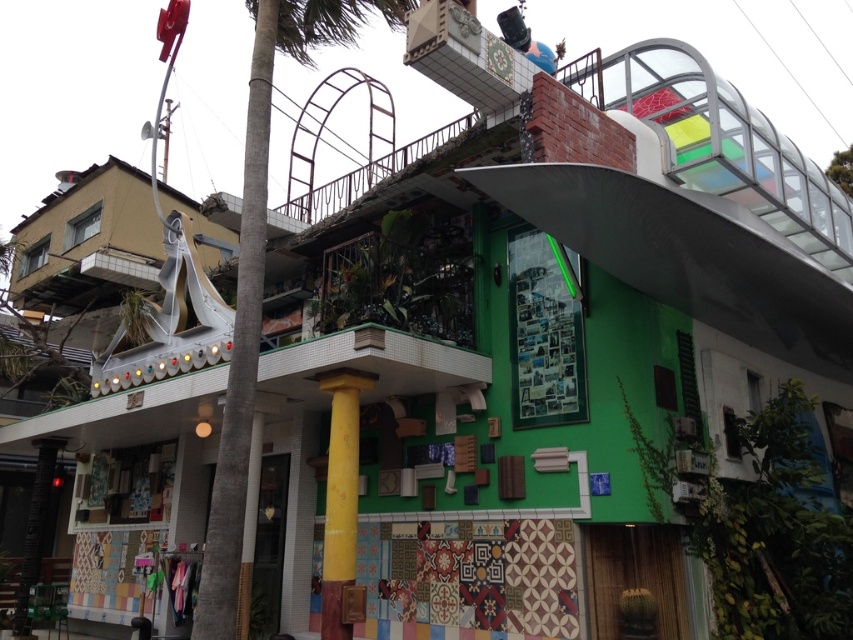
You are a delivery drone with a 1.2 meter wingspan. You need to land on the roof of the building. The landing area is between the green leafy palm tree at center and the yellow matte column at center. Can you safely land there?

The green leafy palm tree at center might be wider than the yellow matte column at center, so there may not be enough space for the drone to land safely between them. It is recommended to choose a different landing spot.

You are standing on the balcony of the building and looking towards the roof. Which object is positioned to the left when comparing the green leafy palm tree at center and the yellow matte column at center?

The green leafy palm tree at center is positioned to the left of the yellow matte column at center.

You are a window cleaner with a ladder that can extend to 6 feet. You need to clean the windows on the roof but must avoid the green leafy palm tree at center and the yellow matte column at center. Can you safely place your ladder between them without hitting either object?

The green leafy palm tree at center and the yellow matte column at center are 6.75 feet apart. Since your ladder extends to 6 feet, which is shorter than the 6.75 feet gap, you can safely place your ladder between them without hitting either object.